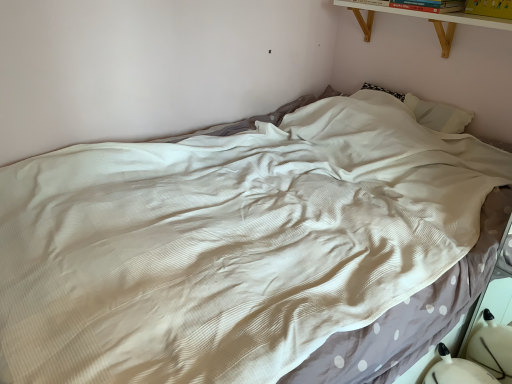
Question: Can you confirm if yellow paper at upper right, the 1th book from the right, is shorter than white wood shelf at upper right?

Choices:
 (A) yes
 (B) no

Answer: (B)

Question: Is yellow paper at upper right, which is counted as the 2th book, starting from the left, in contact with white wood shelf at upper right?

Choices:
 (A) yes
 (B) no

Answer: (B)

Question: From a real-world perspective, is yellow paper at upper right, which is counted as the 2th book, starting from the left, located higher than white wood shelf at upper right?

Choices:
 (A) no
 (B) yes

Answer: (B)

Question: Does yellow paper at upper right, the 1th book from the right, have a smaller size compared to white wood shelf at upper right?

Choices:
 (A) no
 (B) yes

Answer: (B)

Question: Can you confirm if yellow paper at upper right, the 1th book from the right, is positioned to the right of white wood shelf at upper right?

Choices:
 (A) yes
 (B) no

Answer: (A)

Question: Considering the relative positions of white fabric swivel chair at lower right and yellow paper at upper right, the 1th book from the right, in the image provided, is white fabric swivel chair at lower right to the left or to the right of yellow paper at upper right, the 1th book from the right,?

Choices:
 (A) right
 (B) left

Answer: (B)

Question: In the image, is white fabric swivel chair at lower right positioned in front of or behind yellow paper at upper right, which is counted as the 2th book, starting from the left?

Choices:
 (A) behind
 (B) front

Answer: (B)

Question: Is point (436, 377) positioned closer to the camera than point (481, 8)?

Choices:
 (A) farther
 (B) closer

Answer: (B)

Question: Is white fabric swivel chair at lower right spatially inside yellow paper at upper right, which is counted as the 2th book, starting from the left, or outside of it?

Choices:
 (A) inside
 (B) outside

Answer: (B)

Question: Is hardcover book at upper right, the 2th book positioned from the right, wider or thinner than white fabric swivel chair at lower right?

Choices:
 (A) wide
 (B) thin

Answer: (B)

Question: In the image, is hardcover book at upper right, arranged as the 1th book when viewed from the left, on the left side or the right side of white fabric swivel chair at lower right?

Choices:
 (A) left
 (B) right

Answer: (B)

Question: From the image's perspective, is hardcover book at upper right, arranged as the 1th book when viewed from the left, positioned above or below white fabric swivel chair at lower right?

Choices:
 (A) above
 (B) below

Answer: (A)

Question: In the image, is hardcover book at upper right, arranged as the 1th book when viewed from the left, positioned in front of or behind white fabric swivel chair at lower right?

Choices:
 (A) front
 (B) behind

Answer: (B)

Question: Considering their positions, is yellow paper at upper right, the 1th book from the right, located in front of or behind white wood shelf at upper right?

Choices:
 (A) behind
 (B) front

Answer: (A)

Question: Considering the positions of yellow paper at upper right, which is counted as the 2th book, starting from the left, and white wood shelf at upper right in the image, is yellow paper at upper right, which is counted as the 2th book, starting from the left, wider or thinner than white wood shelf at upper right?

Choices:
 (A) wide
 (B) thin

Answer: (B)